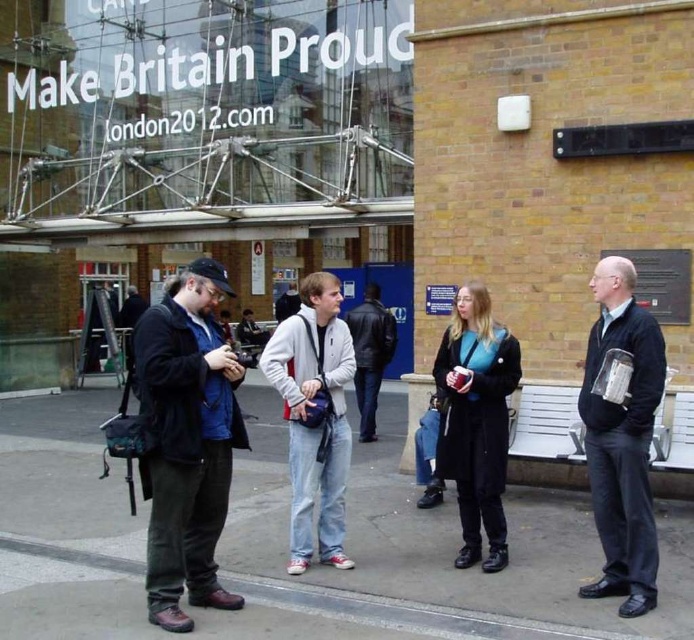
You are taking a photo of the scene and want to focus on both point (634, 404) and point (316, 316). Which point should you focus on first to ensure both are in focus?

You should focus on point (634, 404) first because it is closer to the camera than point (316, 316), ensuring both points will be in focus when using depth of field.

You are a photographer trying to capture a candid shot of the two jackets in the scene. Since you want to ensure both jackets are in focus, you need to know their distance from you. Which jacket is closer to you, the dark gray fabric jacket at right or the leather jacket at center?

The dark gray fabric jacket at right is closer to the viewer than the leather jacket at center, so you should adjust your focus to account for their different distances to ensure both are in focus.

You are standing in front of the building with the glass facade and want to take a photo. You notice two points in the scene at coordinates point (160, 353) and point (314, 440). Which point is closer to your camera position?

Point (160, 353) is closer to the camera than point (314, 440).